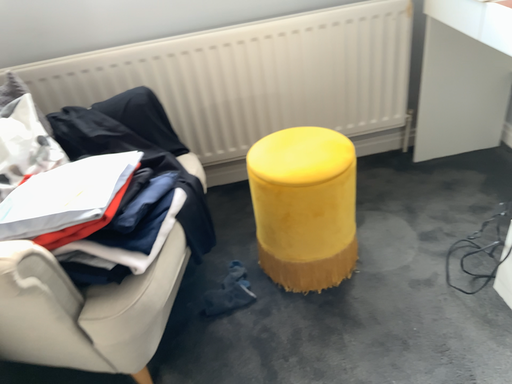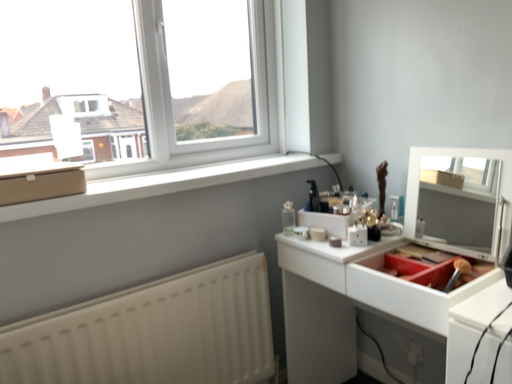
Question: Which way did the camera rotate in the video?

Choices:
 (A) rotated upward
 (B) rotated downward

Answer: (A)